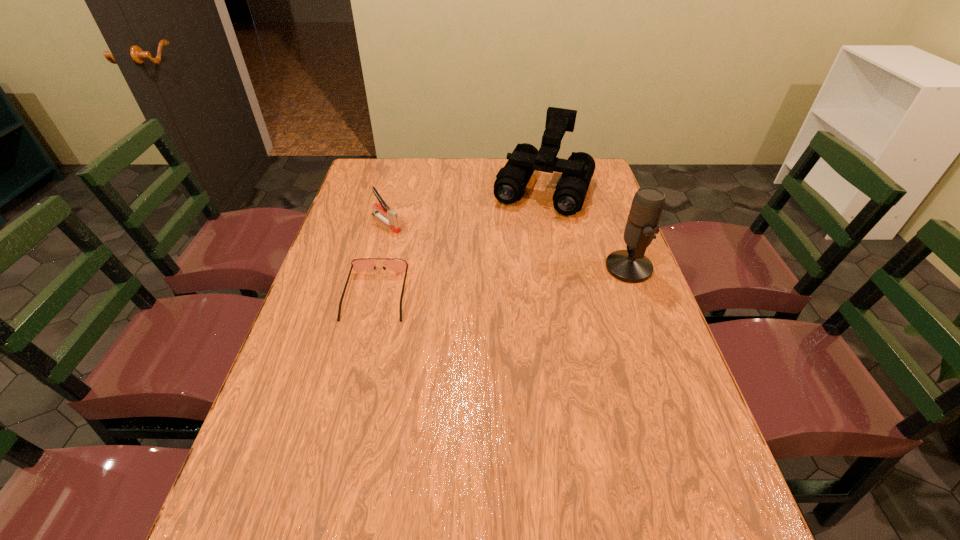
Where is `the shortest object`? the shortest object is located at coordinates (362, 264).

Where is `microphone`? microphone is located at coordinates (630, 265).

Find the location of a particular element. The width and height of the screenshot is (960, 540). stapler is located at coordinates (393, 221).

Image resolution: width=960 pixels, height=540 pixels. I want to click on binoculars, so click(x=511, y=180).

Find the location of a particular element. vacant point located on the bridge of the shortest object is located at coordinates (357, 376).

Find the location of a particular element. The width and height of the screenshot is (960, 540). vacant space located on the handle side of the stapler is located at coordinates (445, 267).

The width and height of the screenshot is (960, 540). What are the coordinates of `free space located 0.330m on the handle side of the stapler` in the screenshot? It's located at (467, 283).

This screenshot has height=540, width=960. I want to click on vacant space positioned 0.370m on the handle side of the stapler, so click(476, 290).

At what (x,y) coordinates should I click in order to perform the action: click on free spot located 0.230m on the front lenses of the binoculars. Please return your answer as a coordinate pair (x, y). The height and width of the screenshot is (540, 960). Looking at the image, I should click on (512, 262).

Find the location of a particular element. This screenshot has height=540, width=960. free space located 0.220m on the front lenses of the binoculars is located at coordinates (513, 260).